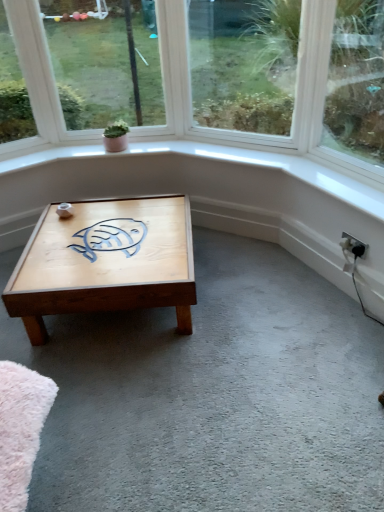
Question: From their relative heights in the image, would you say light brown wooden coffee table at center is taller or shorter than clear glass window at center, positioned as the second window in left-to-right order?

Choices:
 (A) short
 (B) tall

Answer: (A)

Question: Is light brown wooden coffee table at center bigger or smaller than clear glass window at center, positioned as the second window in left-to-right order?

Choices:
 (A) big
 (B) small

Answer: (A)

Question: Considering the real-world distances, which object is closest to the light brown wooden coffee table at center?

Choices:
 (A) white plastic electric outlet at lower right
 (B) clear glass window at center, the first window from the right
 (C) green matte plant at upper center
 (D) clear glass window at upper left, which ranks as the first window in left-to-right order

Answer: (C)

Question: Which of these objects is positioned farthest from the light brown wooden coffee table at center?

Choices:
 (A) green matte plant at upper center
 (B) clear glass window at upper left, which ranks as the first window in left-to-right order
 (C) white plastic electric outlet at lower right
 (D) clear glass window at center, positioned as the second window in left-to-right order

Answer: (D)